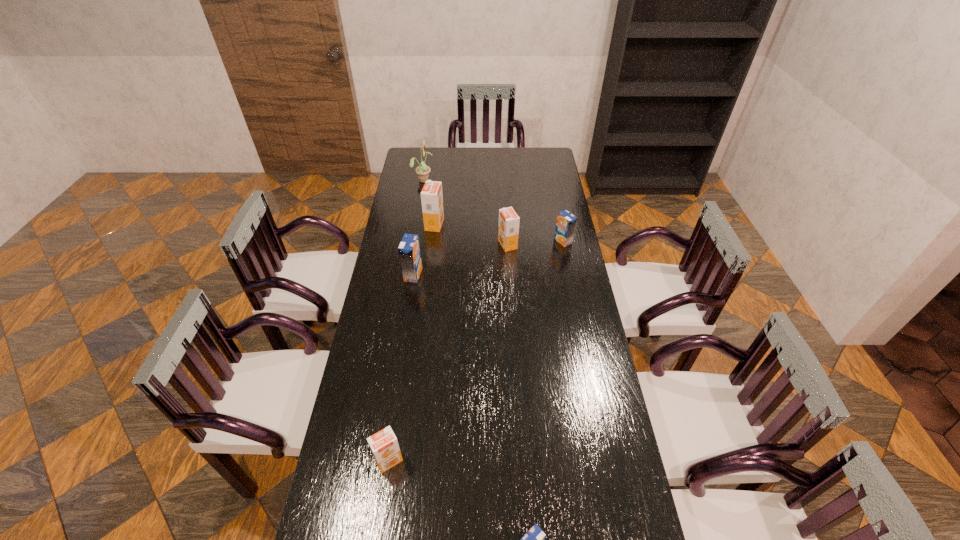
This screenshot has width=960, height=540. I want to click on the nearest orange orange juice, so click(x=384, y=446).

Locate an element on the screen. Image resolution: width=960 pixels, height=540 pixels. the fifth farthest orange_juice is located at coordinates (384, 446).

The width and height of the screenshot is (960, 540). I want to click on blank space located 0.400m on the front-facing side of the farthest object, so click(x=510, y=180).

Locate an element on the screen. Image resolution: width=960 pixels, height=540 pixels. vacant space located 0.060m on the front of the biggest orange orange juice is located at coordinates (433, 241).

You are a GUI agent. You are given a task and a screenshot of the screen. Output one action in this format:
    pyautogui.click(x=<x>, y=<y>)
    Task: Click on the vacant area located on the back of the leftmost blue orange_juice
    This screenshot has height=540, width=960.
    Given the screenshot: What is the action you would take?
    pyautogui.click(x=419, y=236)

Where is `vacant area located on the left of the second nearest orange orange juice`? This screenshot has height=540, width=960. vacant area located on the left of the second nearest orange orange juice is located at coordinates (487, 245).

Find the location of a particular element. vacant space located 0.210m on the left of the rightmost object is located at coordinates (507, 241).

You are a GUI agent. You are given a task and a screenshot of the screen. Output one action in this format:
    pyautogui.click(x=<x>, y=<y>)
    Task: Click on the vacant space located on the back of the second nearest orange_juice
    This screenshot has width=960, height=540.
    Given the screenshot: What is the action you would take?
    (x=402, y=367)

This screenshot has width=960, height=540. I want to click on sunflower that is at the left edge, so click(422, 170).

This screenshot has width=960, height=540. In order to click on object that is at the right edge in this screenshot , I will do `click(566, 222)`.